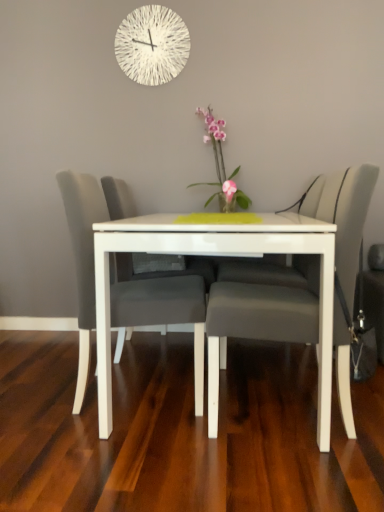
What do you see at coordinates (157, 309) in the screenshot? I see `matte gray chair at center, positioned as the 2th chair in right-to-left order` at bounding box center [157, 309].

The width and height of the screenshot is (384, 512). Identify the location of white glossy table at center. [x=216, y=255].

Image resolution: width=384 pixels, height=512 pixels. What are the coordinates of `matte gray chair at center, positioned as the 2th chair in right-to-left order` in the screenshot? It's located at (157, 309).

Does matte gray chair at center, the first chair viewed from the right, have a lesser height compared to white textured clock at upper center?

No.

Considering the relative sizes of matte gray chair at center, the first chair viewed from the right, and white textured clock at upper center in the image provided, is matte gray chair at center, the first chair viewed from the right, thinner than white textured clock at upper center?

Incorrect, the width of matte gray chair at center, the first chair viewed from the right, is not less than that of white textured clock at upper center.

From a real-world perspective, is matte gray chair at center, which ranks as the second chair in left-to-right order, positioned under white textured clock at upper center based on gravity?

Indeed, from a real-world perspective, matte gray chair at center, which ranks as the second chair in left-to-right order, is positioned beneath white textured clock at upper center.

Does point (310, 308) lie in front of point (165, 26)?

That is True.

Locate an element on the screen. This screenshot has height=512, width=384. wall clock behind the white glossy table at center is located at coordinates (152, 45).

Considering the relative sizes of white textured clock at upper center and white glossy table at center in the image provided, is white textured clock at upper center shorter than white glossy table at center?

Yes.

Is white textured clock at upper center oriented away from white glossy table at center?

No, white textured clock at upper center is not facing the opposite direction of white glossy table at center.

Is white textured clock at upper center at the left side of white glossy table at center?

Correct, you'll find white textured clock at upper center to the left of white glossy table at center.

Who is shorter, matte gray chair at center, which ranks as the second chair in left-to-right order, or matte gray chair at center, the first chair viewed from the left?

Standing shorter between the two is matte gray chair at center, the first chair viewed from the left.

Is matte gray chair at center, which ranks as the second chair in left-to-right order, to the left or to the right of matte gray chair at center, positioned as the 2th chair in right-to-left order, in the image?

Clearly, matte gray chair at center, which ranks as the second chair in left-to-right order, is on the right of matte gray chair at center, positioned as the 2th chair in right-to-left order, in the image.

Based on the photo, is matte gray chair at center, the first chair viewed from the right, far away from matte gray chair at center, positioned as the 2th chair in right-to-left order?

matte gray chair at center, the first chair viewed from the right, is actually quite close to matte gray chair at center, positioned as the 2th chair in right-to-left order.

From the image's perspective, is matte gray chair at center, which ranks as the second chair in left-to-right order, located beneath matte gray chair at center, the first chair viewed from the left?

A: Yes, from the image's perspective, matte gray chair at center, which ranks as the second chair in left-to-right order, is below matte gray chair at center, the first chair viewed from the left.

Is white textured clock at upper center taller or shorter than pink glossy vase at center?

In the image, white textured clock at upper center appears to be shorter than pink glossy vase at center.

Between white textured clock at upper center and pink glossy vase at center, which one has smaller width?

With smaller width is white textured clock at upper center.

Can you tell me how much white textured clock at upper center and pink glossy vase at center differ in facing direction?

The facing directions of white textured clock at upper center and pink glossy vase at center are 0.00288 degrees apart.

Is white textured clock at upper center inside or outside of pink glossy vase at center?

white textured clock at upper center exists outside the volume of pink glossy vase at center.

Is matte gray chair at center, positioned as the 2th chair in right-to-left order, in front of white glossy table at center?

That is False.

Which is more to the right, matte gray chair at center, positioned as the 2th chair in right-to-left order, or white glossy table at center?

white glossy table at center is more to the right.

From a real-world perspective, is matte gray chair at center, the first chair viewed from the left, physically above white glossy table at center?

Correct, in the physical world, matte gray chair at center, the first chair viewed from the left, is higher than white glossy table at center.

Considering the sizes of objects matte gray chair at center, the first chair viewed from the left, and white glossy table at center in the image provided, who is bigger, matte gray chair at center, the first chair viewed from the left, or white glossy table at center?

Bigger between the two is white glossy table at center.

Does point (223, 223) come farther from viewer compared to point (296, 304)?

No, it is in front of (296, 304).

Is white glossy table at center next to matte gray chair at center, the first chair viewed from the right, and touching it?

They are not placed beside each other.

In terms of height, does white glossy table at center look taller or shorter compared to matte gray chair at center, which ranks as the second chair in left-to-right order?

Clearly, white glossy table at center is shorter compared to matte gray chair at center, which ranks as the second chair in left-to-right order.

Is white glossy table at center bigger than matte gray chair at center, which ranks as the second chair in left-to-right order?

Yes.

At what (x,y) coordinates should I click in order to perform the action: click on floral arrangement on the right of white textured clock at upper center. Please return your answer as a coordinate pair (x, y). Image resolution: width=384 pixels, height=512 pixels. Looking at the image, I should click on (221, 166).

Would you say white textured clock at upper center is part of pink glossy vase at center's contents?

Definitely not — white textured clock at upper center is not inside pink glossy vase at center.

Who is more distant, pink glossy vase at center or white textured clock at upper center?

white textured clock at upper center is further away from the camera.

From a real-world perspective, which is physically above, pink glossy vase at center or white textured clock at upper center?

white textured clock at upper center.

Starting from the white textured clock at upper center, which chair is the 2nd one to the right? Please provide its 2D coordinates.

[(258, 319)]

You are a GUI agent. You are given a task and a screenshot of the screen. Output one action in this format:
    pyautogui.click(x=<x>, y=<y>)
    Task: Click on the wall clock located behind the white glossy table at center
    The image size is (384, 512).
    Given the screenshot: What is the action you would take?
    pyautogui.click(x=152, y=45)

Which object lies nearer to the anchor point matte gray chair at center, which ranks as the second chair in left-to-right order, matte gray chair at center, positioned as the 2th chair in right-to-left order, or white textured clock at upper center?

Based on the image, matte gray chair at center, positioned as the 2th chair in right-to-left order, appears to be nearer to matte gray chair at center, which ranks as the second chair in left-to-right order.

Which object lies nearer to the anchor point pink glossy vase at center, white textured clock at upper center or white glossy table at center?

white textured clock at upper center.

Considering their positions, is matte gray chair at center, positioned as the 2th chair in right-to-left order, positioned closer to pink glossy vase at center than white glossy table at center?

matte gray chair at center, positioned as the 2th chair in right-to-left order.

Based on the photo, estimate the real-world distances between objects in this image. Which object is closer to pink glossy vase at center, white textured clock at upper center or matte gray chair at center, which ranks as the second chair in left-to-right order?

white textured clock at upper center.

Which object lies nearer to the anchor point white glossy table at center, matte gray chair at center, the first chair viewed from the left, or white textured clock at upper center?

matte gray chair at center, the first chair viewed from the left.

From the picture: Which object lies further to the anchor point matte gray chair at center, which ranks as the second chair in left-to-right order, white glossy table at center or white textured clock at upper center?

white textured clock at upper center is positioned further to the anchor matte gray chair at center, which ranks as the second chair in left-to-right order.

Based on their spatial positions, is white glossy table at center or matte gray chair at center, the first chair viewed from the left, further from white textured clock at upper center?

white glossy table at center.

From the image, which object appears to be nearer to matte gray chair at center, the first chair viewed from the right, white textured clock at upper center or matte gray chair at center, positioned as the 2th chair in right-to-left order?

matte gray chair at center, positioned as the 2th chair in right-to-left order.

The width and height of the screenshot is (384, 512). In order to click on table between matte gray chair at center, positioned as the 2th chair in right-to-left order, and matte gray chair at center, the first chair viewed from the right, in the horizontal direction in this screenshot , I will do `click(216, 255)`.

The image size is (384, 512). I want to click on chair between white textured clock at upper center and matte gray chair at center, which ranks as the second chair in left-to-right order, from top to bottom, so click(x=157, y=309).

Identify the location of floral arrangement between white textured clock at upper center and matte gray chair at center, positioned as the 2th chair in right-to-left order, in the up-down direction. (221, 166).

The width and height of the screenshot is (384, 512). Identify the location of chair located between matte gray chair at center, which ranks as the second chair in left-to-right order, and pink glossy vase at center in the depth direction. (157, 309).